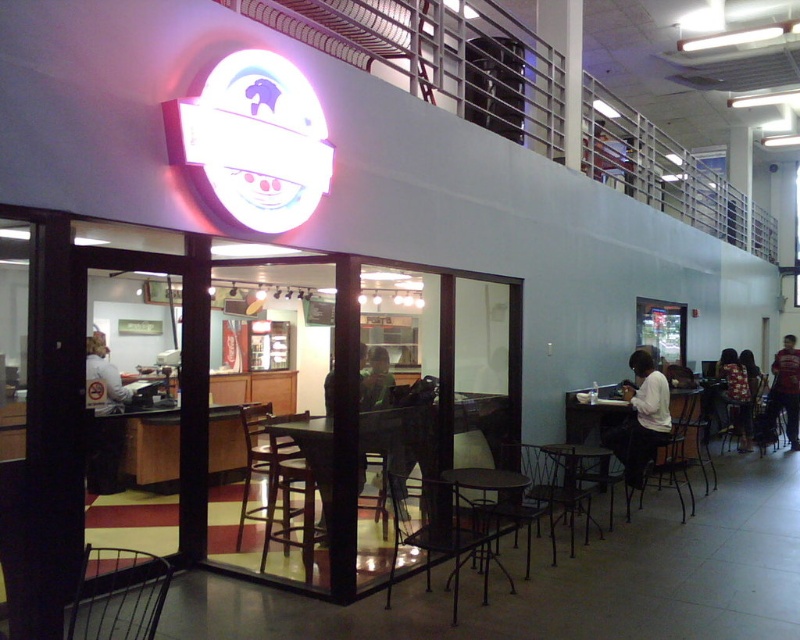
You are a food delivery person who needs to place a hot meal on the nearest available surface. You see the white matte shirt at lower right and the matte black table at center. Which surface should you choose to place the meal?

The matte black table at center is the correct surface to place the meal. The white matte shirt at lower right is unsuitable for placing hot food as it is clothing, while the matte black table at center is a stable surface. Additionally, the two objects are 15.07 inches apart, so the table is within reach.

You are a customer at the food stall and want to place your bag on the floor. The white matte shirt at lower right is currently occupying the space. Where should you place your bag instead?

You should place your bag somewhere else since the white matte shirt at lower right is at point (641, 419) and that space is already occupied.